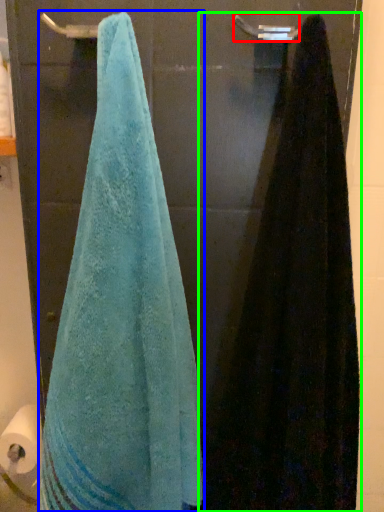
Question: Which object is positioned closest to towel bar (highlighted by a red box)? Select from towel (highlighted by a blue box) and towel (highlighted by a green box).

Choices:
 (A) towel
 (B) towel

Answer: (B)